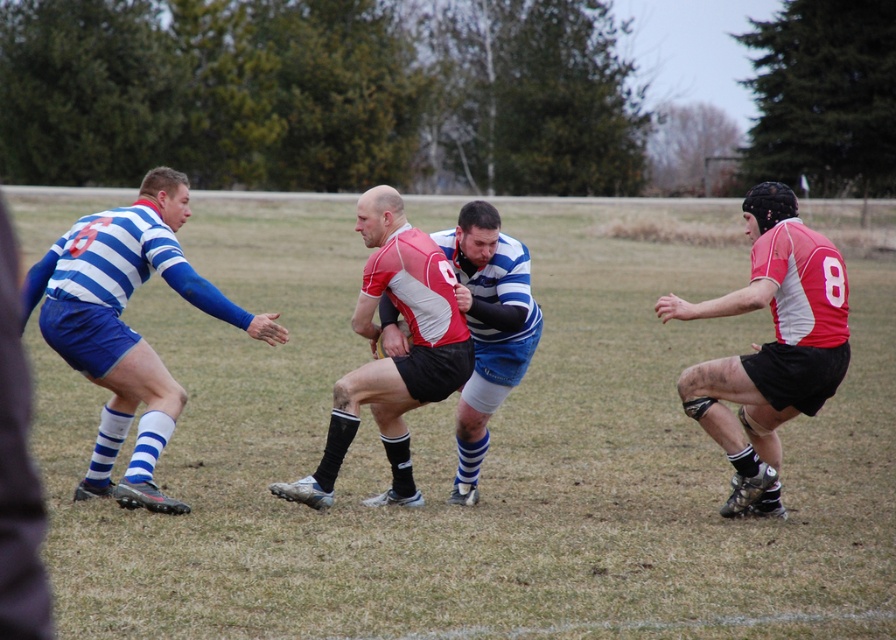
In the scene shown: You are a referee standing at the center of the rugby field. You need to determine if the ball is within the 7 meters from the point marked at coordinates point (665, 314). Based on the description, is the ball within this distance?

The distance of point (665, 314) from the viewer is 6.99 meters, so the ball is within the 7 meters distance from the point marked at coordinates point (665, 314).

You are a sports analyst observing the rugby match. You notice the green grass at center and the red and white jersey at center. Which object occupies more horizontal space in the image?

The green grass at center is wider than the red and white jersey at center, so it occupies more horizontal space in the image.